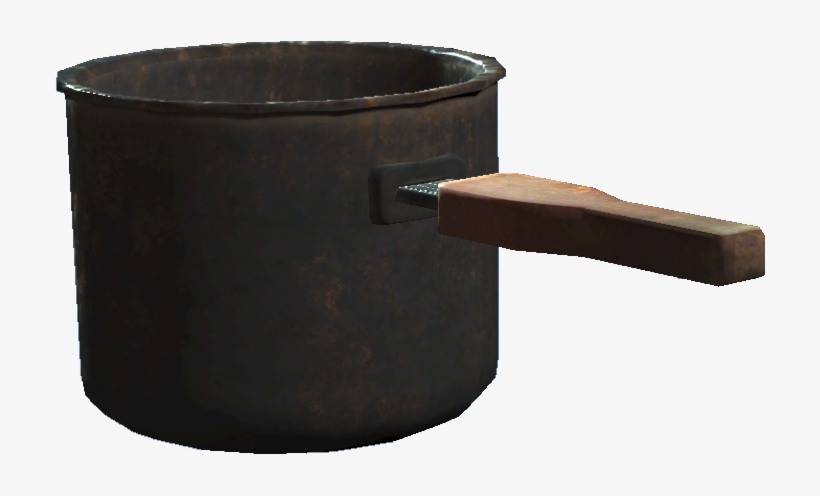
Locate an element on the screen. The image size is (820, 496). pot is located at coordinates (280, 163), (567, 226).